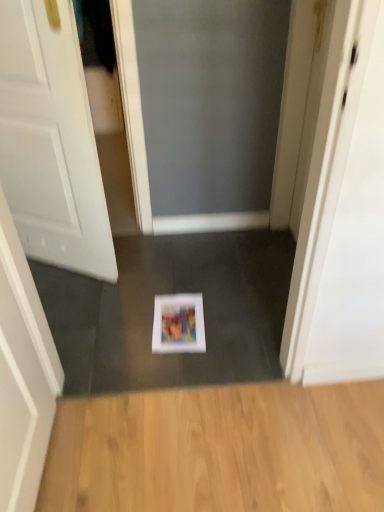
Question: From a real-world perspective, is matte paper magazine at center above or below light brown wood flooring at lower center?

Choices:
 (A) below
 (B) above

Answer: (B)

Question: From the image's perspective, is matte paper magazine at center located above or below light brown wood flooring at lower center?

Choices:
 (A) above
 (B) below

Answer: (A)

Question: Which of these objects is positioned farthest from the white glossy screen door at upper right?

Choices:
 (A) matte paper magazine at center
 (B) white matte door at center
 (C) light brown wood flooring at lower center

Answer: (B)

Question: Estimate the real-world distances between objects in this image. Which object is closer to the matte paper magazine at center?

Choices:
 (A) white glossy screen door at upper right
 (B) light brown wood flooring at lower center
 (C) white matte door at center

Answer: (B)